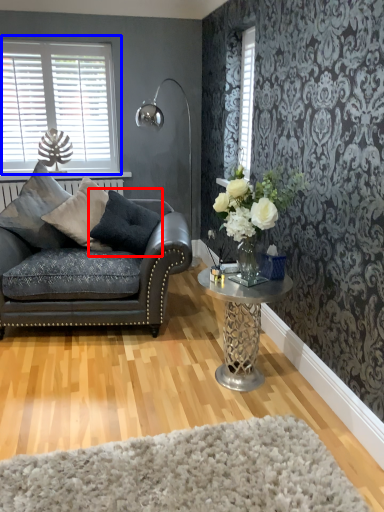
Question: Which object is further to the camera taking this photo, pillow (highlighted by a red box) or window (highlighted by a blue box)?

Choices:
 (A) pillow
 (B) window

Answer: (B)